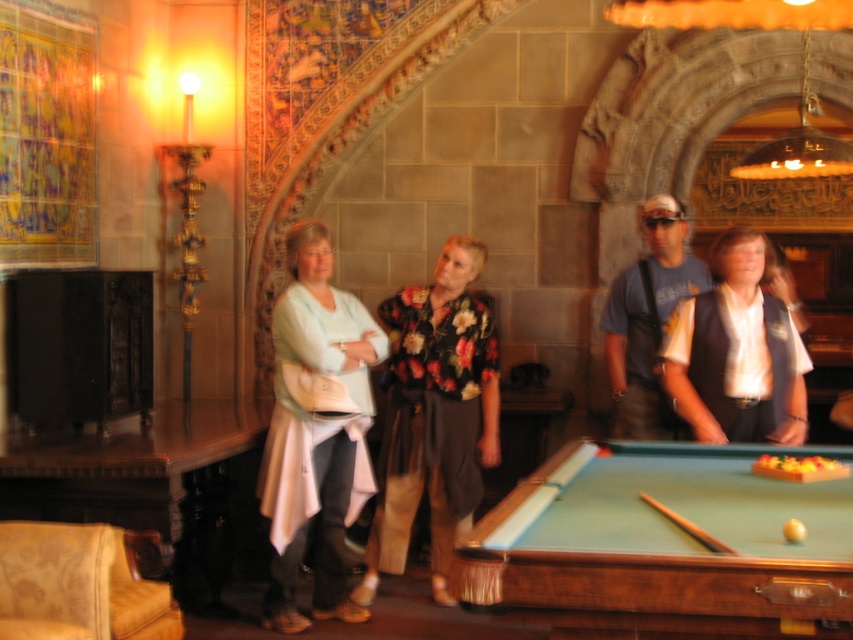
Question: Is light blue fabric coat at center to the left of blue t-shirt at center from the viewer's perspective?

Choices:
 (A) no
 (B) yes

Answer: (B)

Question: Which point is farther from the camera taking this photo?

Choices:
 (A) (838, 529)
 (B) (287, 600)
 (C) (450, 244)

Answer: (C)

Question: Where is green felt pool table at center located in relation to blue t-shirt at center in the image?

Choices:
 (A) above
 (B) below

Answer: (B)

Question: Among these objects, which one is farthest from the camera?

Choices:
 (A) light blue fabric coat at center
 (B) white shirt with vest at center
 (C) floral print blouse at center

Answer: (C)

Question: Does light blue fabric coat at center have a smaller size compared to blue t-shirt at center?

Choices:
 (A) yes
 (B) no

Answer: (B)

Question: Which object is closer to the camera taking this photo?

Choices:
 (A) light blue fabric coat at center
 (B) green felt pool table at center

Answer: (B)